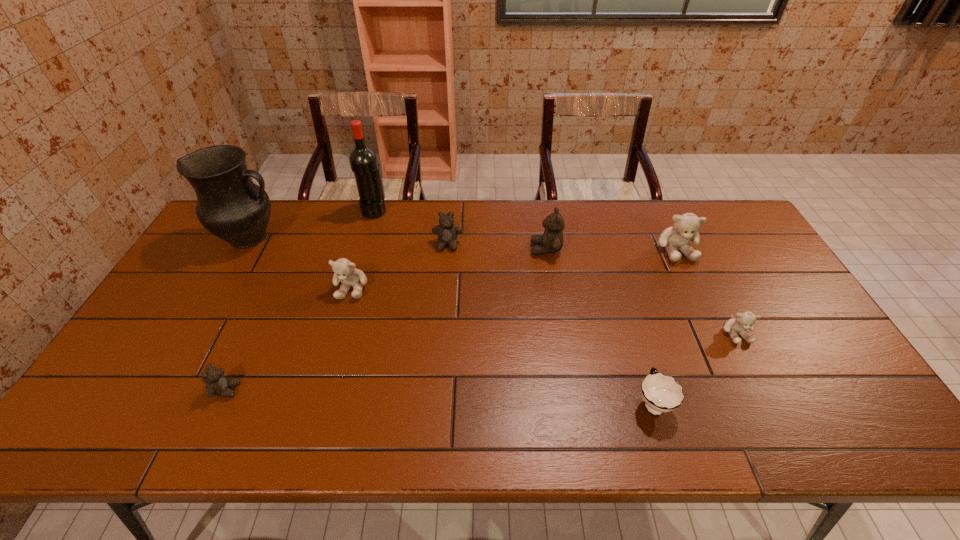
Identify the location of the nearest brown teddy bear. The height and width of the screenshot is (540, 960). (217, 384).

This screenshot has height=540, width=960. Find the location of `the second object from left to right`. the second object from left to right is located at coordinates (217, 384).

At what (x,y) coordinates should I click in order to perform the action: click on the seventh farthest object. Please return your answer as a coordinate pair (x, y). Looking at the image, I should click on pyautogui.click(x=745, y=320).

Locate an element on the screen. the smallest gray teddy bear is located at coordinates (745, 320).

The image size is (960, 540). What are the coordinates of `cup` in the screenshot? It's located at (661, 393).

At what (x,y) coordinates should I click in order to perform the action: click on the third object from right to left. Please return your answer as a coordinate pair (x, y). Looking at the image, I should click on (661, 393).

Where is `vacant area located on the right of the wine bottle`? vacant area located on the right of the wine bottle is located at coordinates (470, 211).

You are a GUI agent. You are given a task and a screenshot of the screen. Output one action in this format:
    pyautogui.click(x=<x>, y=<y>)
    Task: Click on the free space located on the handle side of the black pitcher
    Image resolution: width=960 pixels, height=540 pixels.
    Given the screenshot: What is the action you would take?
    pyautogui.click(x=381, y=238)

The height and width of the screenshot is (540, 960). In order to click on free space located on the face of the fourth teddy bear from left to right in this screenshot , I will do `click(484, 249)`.

Where is `vacant space situated 0.050m on the face of the fourth teddy bear from left to right`? Image resolution: width=960 pixels, height=540 pixels. vacant space situated 0.050m on the face of the fourth teddy bear from left to right is located at coordinates (515, 249).